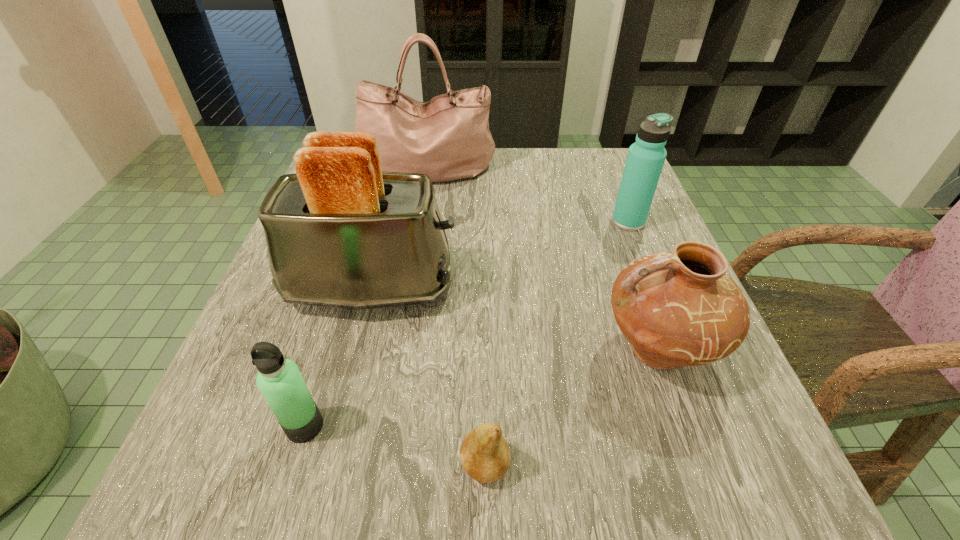
The height and width of the screenshot is (540, 960). I want to click on toaster located at the left edge, so click(x=341, y=233).

What are the coordinates of `thermos bottle present at the left edge` in the screenshot? It's located at (279, 380).

This screenshot has height=540, width=960. I want to click on thermos bottle located in the right edge section of the desktop, so click(x=646, y=157).

At what (x,y) coordinates should I click in order to perform the action: click on pottery that is at the right edge. Please return your answer as a coordinate pair (x, y). This screenshot has width=960, height=540. Looking at the image, I should click on (681, 308).

Locate an element on the screen. This screenshot has width=960, height=540. object located at the far left corner is located at coordinates (447, 138).

At what (x,y) coordinates should I click in order to perform the action: click on object at the near left corner. Please return your answer as a coordinate pair (x, y). The image size is (960, 540). Looking at the image, I should click on (279, 380).

Where is `free space at the far edge of the desktop`? This screenshot has width=960, height=540. free space at the far edge of the desktop is located at coordinates (534, 186).

I want to click on vacant space at the left edge of the desktop, so click(344, 336).

Find the location of a particular element. blank area at the near left corner is located at coordinates (262, 478).

Locate an element on the screen. The height and width of the screenshot is (540, 960). free space at the far right corner of the desktop is located at coordinates (593, 179).